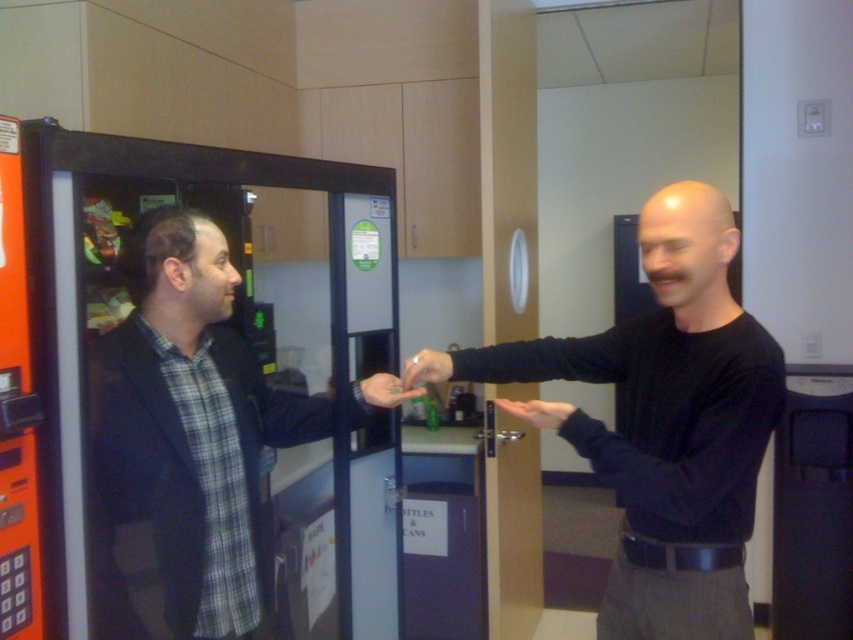
Question: Which point is farther from the camera taking this photo?

Choices:
 (A) (422, 352)
 (B) (529, 406)
 (C) (402, 390)
 (D) (683, 547)

Answer: (A)

Question: Which point is farther to the camera?

Choices:
 (A) black matte shirt at center
 (B) plaid shirt at left

Answer: (B)

Question: Where is smooth skin hand at center located in relation to matte black hand at center in the image?

Choices:
 (A) left
 (B) right

Answer: (B)

Question: Does black matte shirt at center lie in front of plaid shirt at left?

Choices:
 (A) no
 (B) yes

Answer: (B)

Question: Does black matte shirt at center appear over smooth skin hand at center?

Choices:
 (A) yes
 (B) no

Answer: (A)

Question: Which object is farther from the camera taking this photo?

Choices:
 (A) black matte shirt at center
 (B) plaid shirt at left
 (C) matte black hand at center
 (D) matte plastic hand at center

Answer: (D)